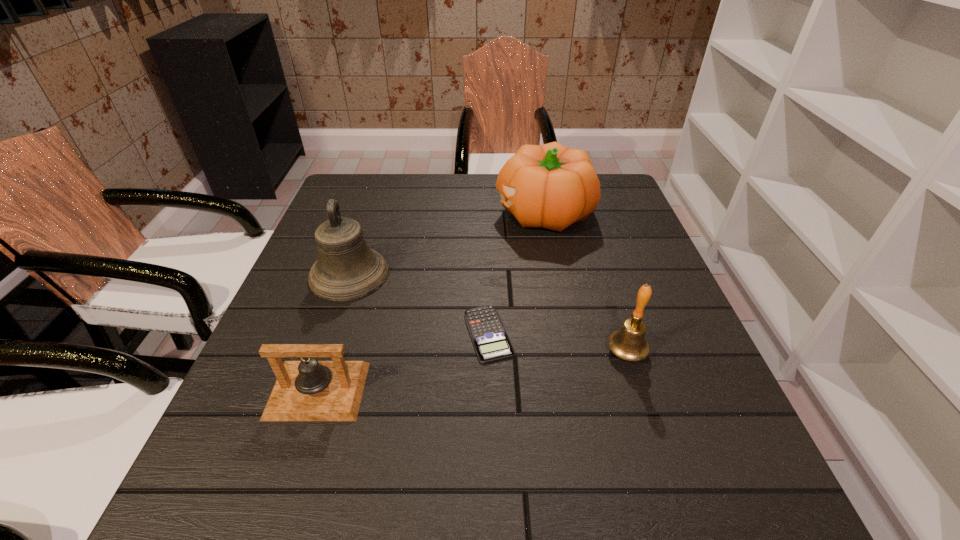
I want to click on the fourth closest object to the shortest bell, so click(551, 186).

Image resolution: width=960 pixels, height=540 pixels. In order to click on the third closest object to the rightmost bell in this screenshot , I will do `click(309, 390)`.

Identify which bell is the second nearest to the shortest bell. Please provide its 2D coordinates. Your answer should be formatted as a tuple, i.e. [(x, y)], where the tuple contains the x and y coordinates of a point satisfying the conditions above.

[(629, 343)]

Locate an element on the screen. bell that is the closest to the second farthest object is located at coordinates (309, 390).

Locate an element on the screen. Image resolution: width=960 pixels, height=540 pixels. vacant point that satisfies the following two spatial constraints: 1. on the carved face of the farthest object; 2. on the left side of the rightmost bell is located at coordinates (570, 352).

Locate an element on the screen. free space in the image that satisfies the following two spatial constraints: 1. on the back side of the shortest bell; 2. on the left side of the rightmost bell is located at coordinates (330, 352).

Locate an element on the screen. This screenshot has height=540, width=960. free space in the image that satisfies the following two spatial constraints: 1. on the carved face of the pumpkin; 2. on the front side of the shortest bell is located at coordinates (578, 390).

Find the location of a particular element. Image resolution: width=960 pixels, height=540 pixels. free space that satisfies the following two spatial constraints: 1. on the back side of the rightmost bell; 2. on the right side of the shortest bell is located at coordinates (330, 352).

The width and height of the screenshot is (960, 540). What are the coordinates of `vacant space that satisfies the following two spatial constraints: 1. on the carved face of the pumpkin; 2. on the front side of the fourth nearest object` in the screenshot? It's located at (556, 274).

At what (x,y) coordinates should I click in order to perform the action: click on vacant area that satisfies the following two spatial constraints: 1. on the carved face of the farthest object; 2. on the left side of the rightmost bell. Please return your answer as a coordinate pair (x, y). This screenshot has height=540, width=960. Looking at the image, I should click on (570, 352).